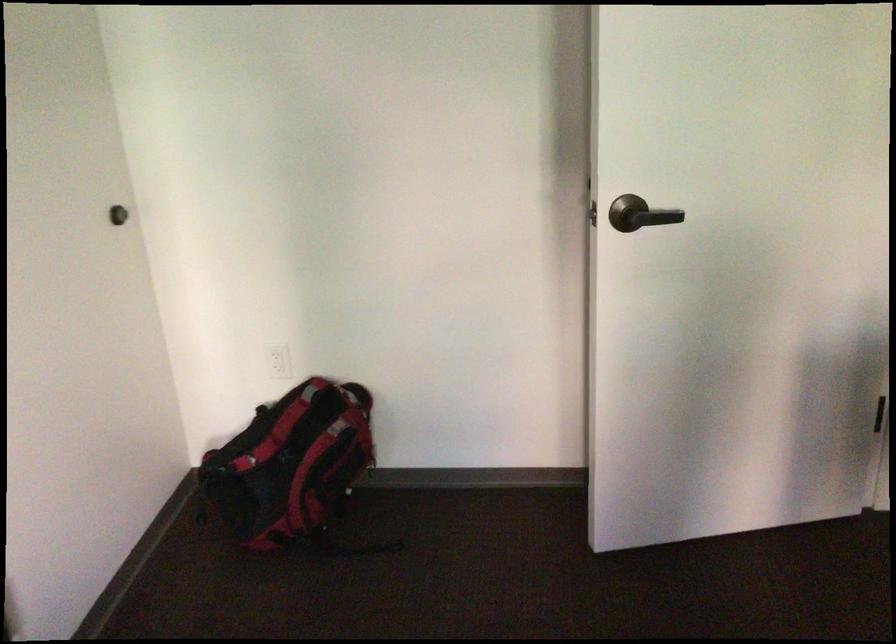
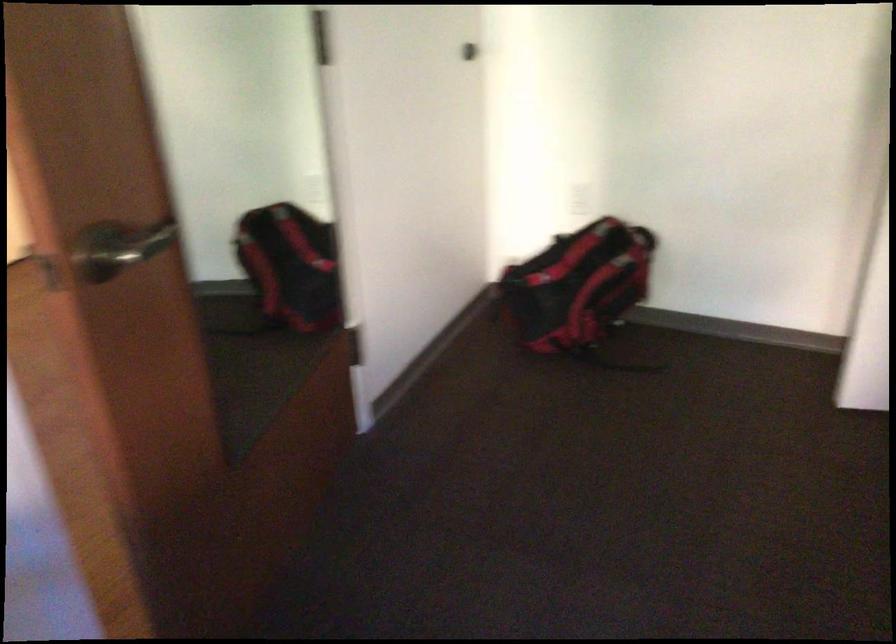
Question: The camera is either moving clockwise (left) or counter-clockwise (right) around the object. The first image is from the beginning of the video and the second image is from the end. Is the camera moving left or right when shooting the video?

Choices:
 (A) Left
 (B) Right

Answer: (B)